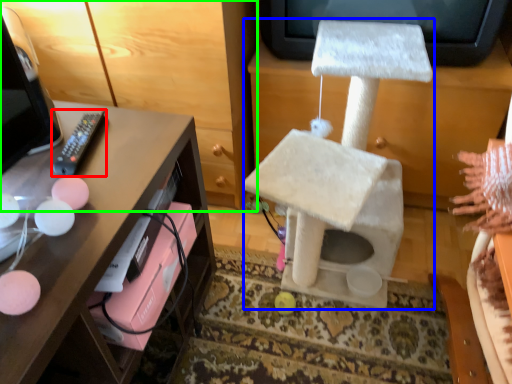
Question: Which object is the closest to the remote (highlighted by a red box)? Choose among these: swivel chair (highlighted by a blue box) or furniture (highlighted by a green box).

Choices:
 (A) swivel chair
 (B) furniture

Answer: (B)